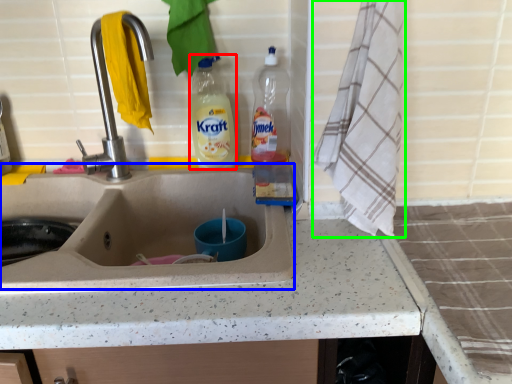
Question: Which is nearer to the bottle (highlighted by a red box)? sink (highlighted by a blue box) or bath towel (highlighted by a green box).

Choices:
 (A) sink
 (B) bath towel

Answer: (A)